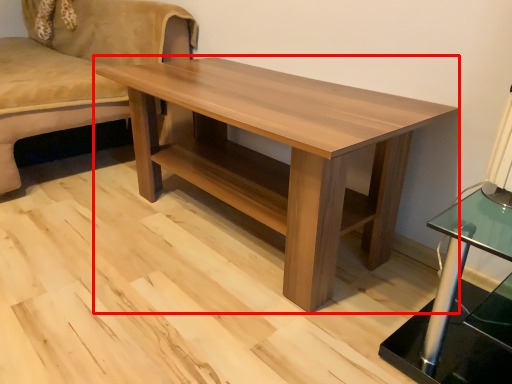
Question: From the image, what is the correct spatial relationship of coffee table (annotated by the red box) in relation to studio couch?

Choices:
 (A) left
 (B) right

Answer: (B)